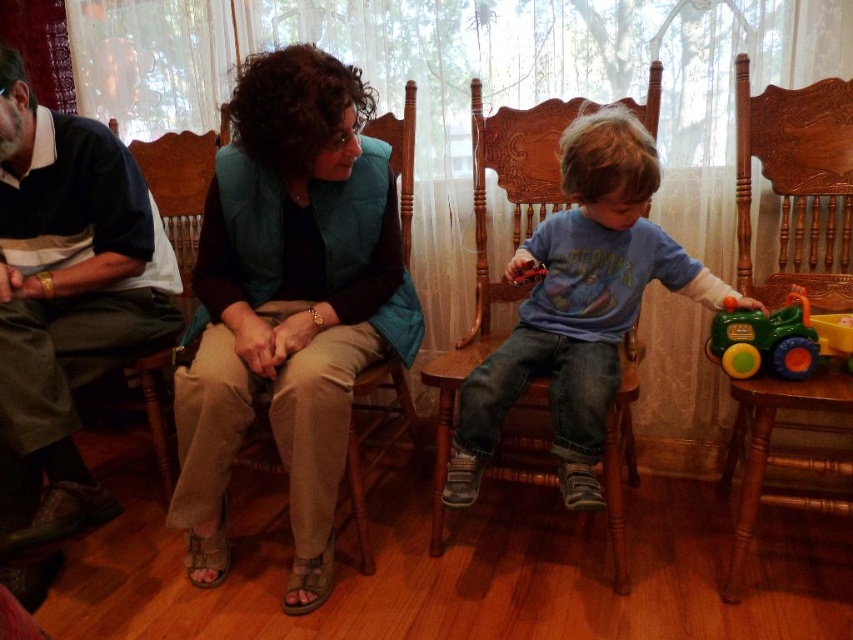
In the scene shown: In the scene, there are two objects of interest. The first is the dark blue shirt at left and the second is the wooden carved rocking chair at right. From the perspective of an observer standing in front of the wooden table, which object appears taller?

The dark blue shirt at left appears taller than the wooden carved rocking chair at right.

You are standing in the living room and want to reach the point marked as point (x=137, y=340). There are two chairs between you and the point. The first chair is where the woman is sitting, and the second chair is where the child is sitting. Can you walk straight to the point without moving any chairs?

The point (x=137, y=340) is 5.30 feet from the viewer. Since there are two chairs between you and the point, you would need to move at least one of the chairs to walk straight to the point unless there is enough space between or around the chairs to navigate through without moving them. However, the description does not provide information about the spacing between the chairs, so it is uncertain if you can walk straight without moving them.